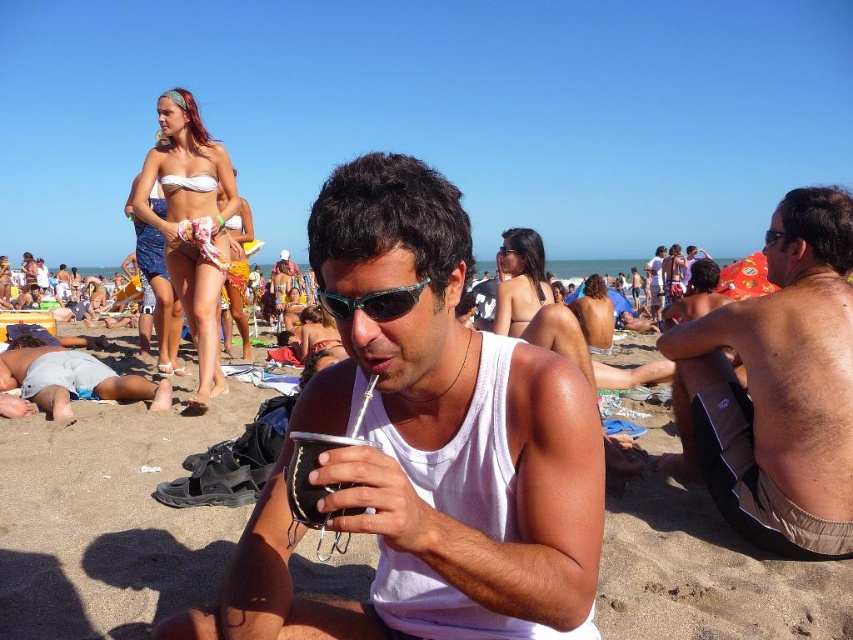
Can you confirm if light blue denim shorts at lower left is bigger than sunglasses at center?

Indeed, light blue denim shorts at lower left has a larger size compared to sunglasses at center.

Between light blue denim shorts at lower left and sunglasses at center, which one appears on the right side from the viewer's perspective?

sunglasses at center is more to the right.

Is point (157, 403) positioned behind point (351, 314)?

Yes, it is behind point (351, 314).

The height and width of the screenshot is (640, 853). I want to click on light blue denim shorts at lower left, so coord(68,381).

Is shiny black sunglasses at right smaller than light blue denim shorts at lower left?

Yes, shiny black sunglasses at right is smaller than light blue denim shorts at lower left.

Image resolution: width=853 pixels, height=640 pixels. Find the location of `shiny black sunglasses at right`. shiny black sunglasses at right is located at coordinates (776, 387).

Does point (688, 381) come farther from viewer compared to point (323, 440)?

Yes, it is.

Between point (724, 497) and point (303, 451), which one is positioned in front?

Point (303, 451) is in front.

Locate an element on the screen. The width and height of the screenshot is (853, 640). shiny black sunglasses at right is located at coordinates (776, 387).